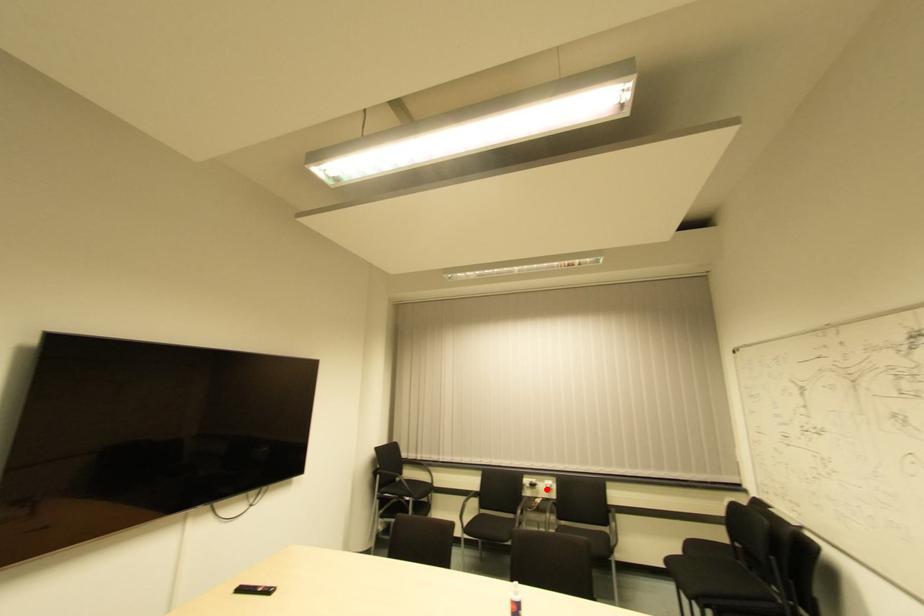
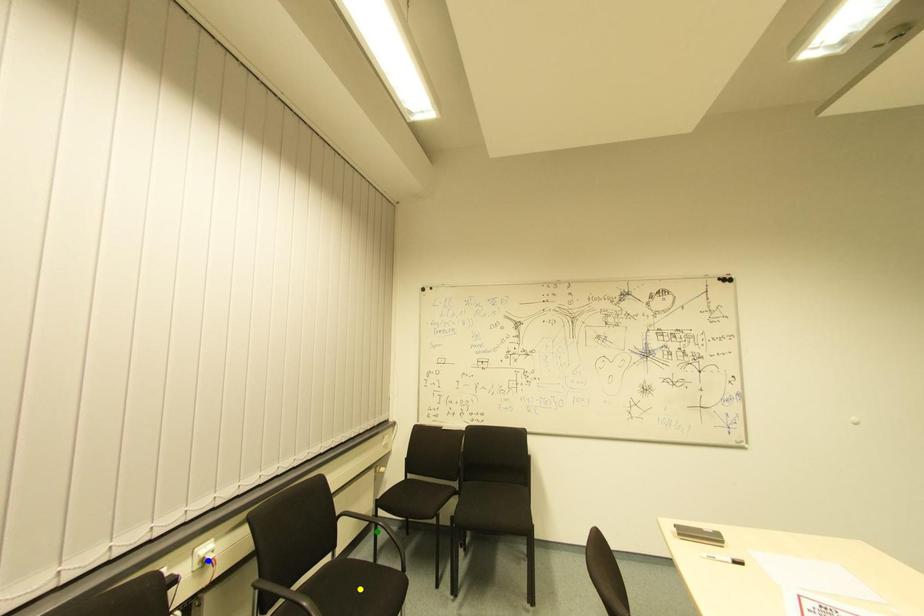
Question: I am providing you with two images of the same scene from different viewpoints. A red point is marked on the first image. You are given multiple points on the second image. Which spot in image 2 lines up with the point in image 1?

Choices:
 (A) green point
 (B) yellow point
 (C) blue point

Answer: (C)